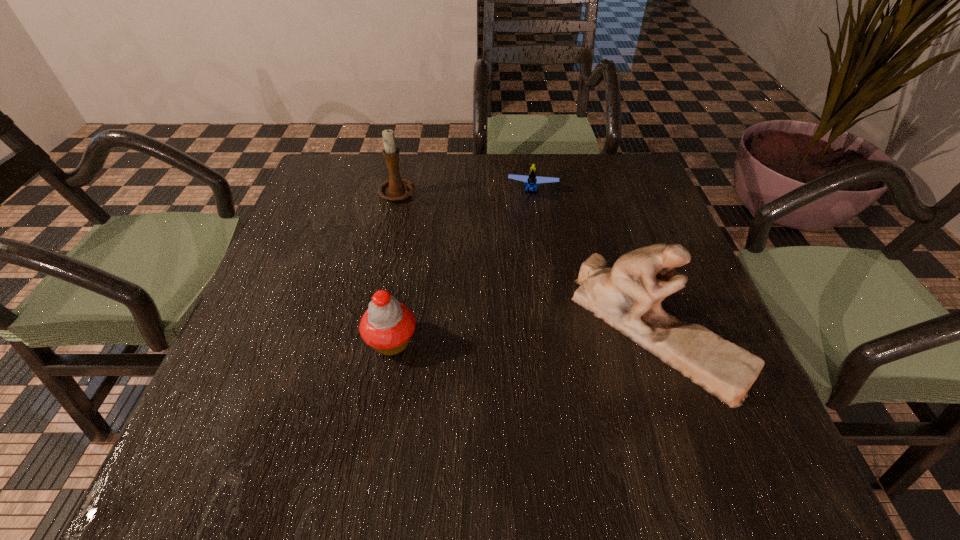
Find the location of a particular element. object that is the second closest one to the candle holder is located at coordinates (387, 325).

Locate an element on the screen. This screenshot has height=540, width=960. free location that satisfies the following two spatial constraints: 1. on the front side of the candle holder; 2. on the right side of the cupcake is located at coordinates (366, 342).

At what (x,y) coordinates should I click in order to perform the action: click on vacant space that satisfies the following two spatial constraints: 1. on the back side of the third tallest object; 2. on the right side of the Lego. Please return your answer as a coordinate pair (x, y). The image size is (960, 540). Looking at the image, I should click on (418, 191).